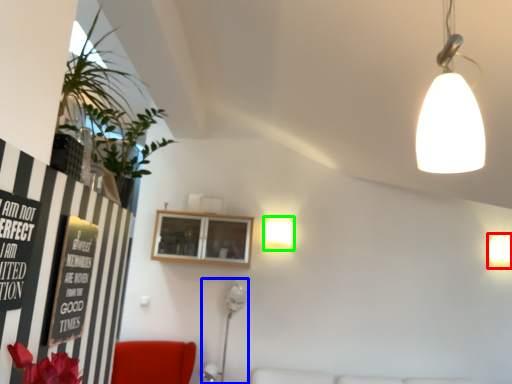
Question: Based on their relative distances, which object is farther from lamp (highlighted by a red box)? Choose from fixture (highlighted by a blue box) and lamp (highlighted by a green box).

Choices:
 (A) fixture
 (B) lamp

Answer: (A)